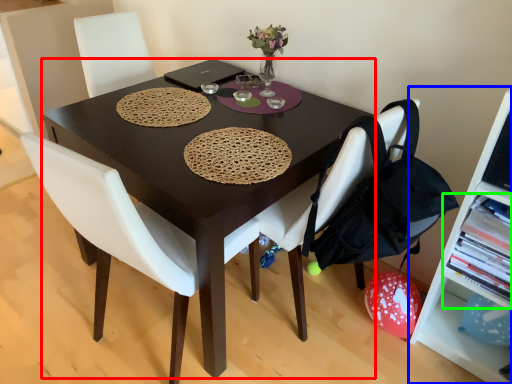
Question: Which is farther away from desk (highlighted by a red box)? shelf (highlighted by a blue box) or shelf (highlighted by a green box)?

Choices:
 (A) shelf
 (B) shelf

Answer: (A)